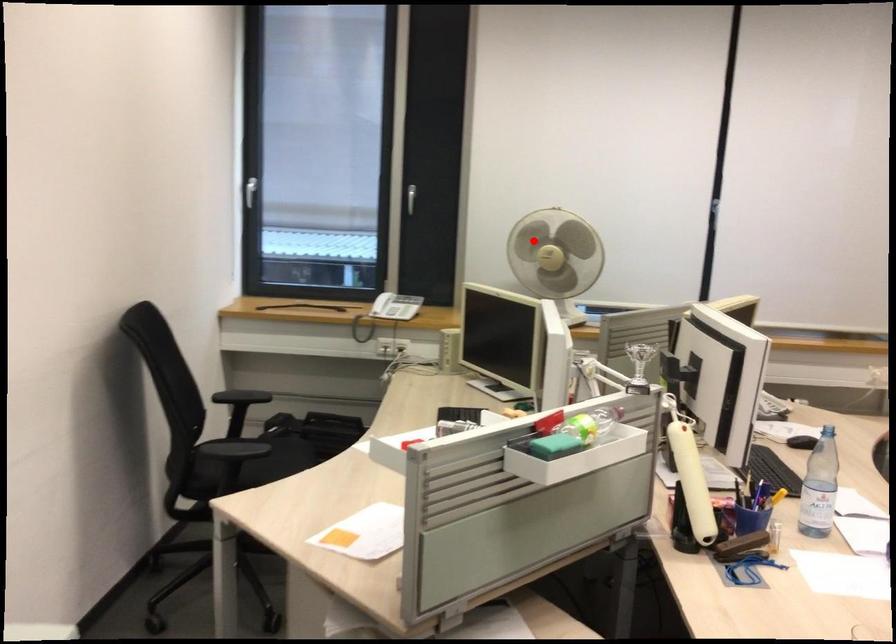
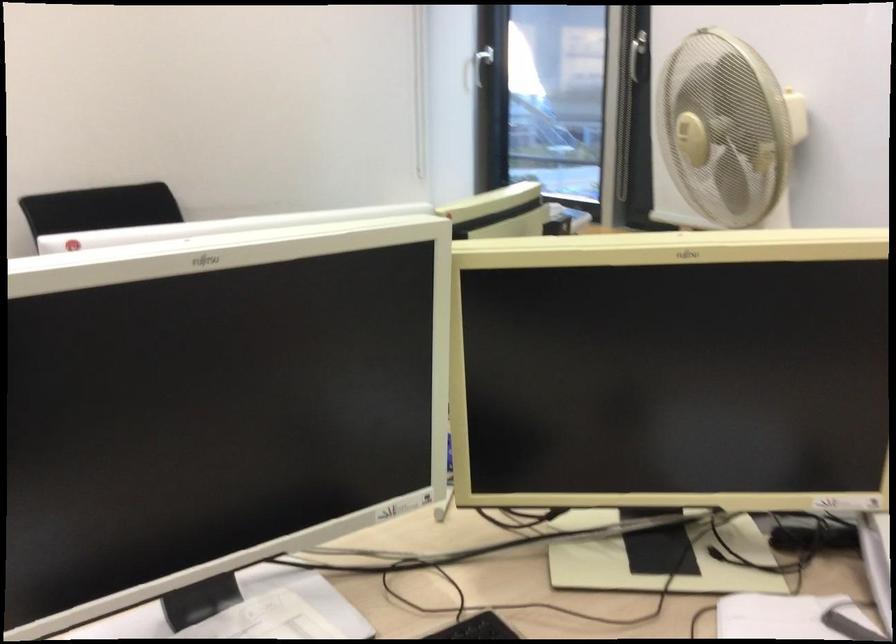
Question: I am providing you with two images of the same scene from different viewpoints. Image1 has a red point marked. In image2, the corresponding 3D location appears at what relative position? Reply with the corresponding letter.

Choices:
 (A) Closer
 (B) Farther

Answer: (A)